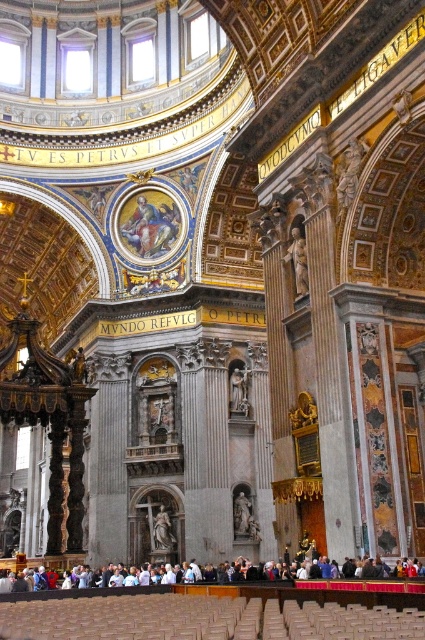
You are standing in the grand cathedral and want to take a photo of the white marble statue at center. If your camera has a maximum focus range of 30 meters, will you be able to capture a clear image of the statue from your current position?

The white marble statue at center is 34.30 meters away from the viewer. Since the camera can only focus up to 30 meters, it won,t be able to capture a clear image of the statue from the current position.

Consider the image. You are an art conservator assessing the statues in the cathedral. You notice the white marble statue at center and the smooth marble statue at center. Which one might require a wider base to prevent tipping?

The white marble statue at center might require a wider base to prevent tipping since it might be wider than the smooth marble statue at center.

You are an art student visiting the cathedral and want to sketch both the white marble statue at center and the smooth marble statue at center. Which statue should you choose if you want to draw a taller one?

The white marble statue at center is taller than the smooth marble statue at center, so you should choose the white marble statue at center for your sketch.